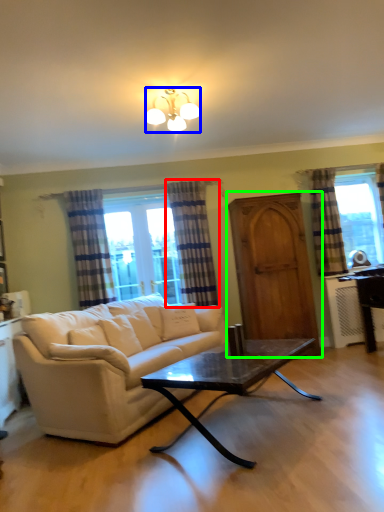
Question: Estimate the real-world distances between objects in this image. Which object is farther from curtain (highlighted by a red box), lamp (highlighted by a blue box) or screen door (highlighted by a green box)?

Choices:
 (A) lamp
 (B) screen door

Answer: (A)